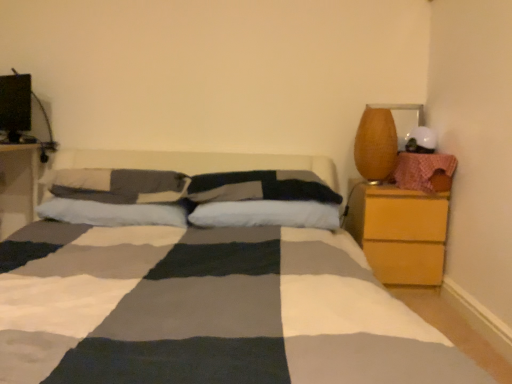
Question: Is white soft pillow at center, placed as the fourth pillow when sorted from left to right, smaller than matte brown vase at right?

Choices:
 (A) no
 (B) yes

Answer: (A)

Question: Is matte brown vase at right a part of white soft pillow at center, placed as the fourth pillow when sorted from left to right?

Choices:
 (A) yes
 (B) no

Answer: (B)

Question: Does white soft pillow at center, which is the 1th pillow in right-to-left order, have a lesser height compared to matte brown vase at right?

Choices:
 (A) yes
 (B) no

Answer: (A)

Question: Can you confirm if white soft pillow at center, placed as the fourth pillow when sorted from left to right, is taller than matte brown vase at right?

Choices:
 (A) yes
 (B) no

Answer: (B)

Question: From a real-world perspective, is white soft pillow at center, placed as the fourth pillow when sorted from left to right, positioned under matte brown vase at right based on gravity?

Choices:
 (A) no
 (B) yes

Answer: (B)

Question: Is white soft pillow at center, which is the 1th pillow in right-to-left order, bigger than matte brown vase at right?

Choices:
 (A) no
 (B) yes

Answer: (B)

Question: Is white cotton pillow at center, positioned as the fourth pillow in right-to-left order, surrounding white soft pillow at center, acting as the second pillow starting from the left?

Choices:
 (A) no
 (B) yes

Answer: (A)

Question: Is white cotton pillow at center, the 1th pillow when ordered from left to right, not inside white soft pillow at center, the 3th pillow positioned from the right?

Choices:
 (A) yes
 (B) no

Answer: (A)

Question: Considering the relative sizes of white cotton pillow at center, the 1th pillow when ordered from left to right, and white soft pillow at center, the 3th pillow positioned from the right, in the image provided, is white cotton pillow at center, the 1th pillow when ordered from left to right, thinner than white soft pillow at center, the 3th pillow positioned from the right,?

Choices:
 (A) no
 (B) yes

Answer: (A)

Question: Does white cotton pillow at center, positioned as the fourth pillow in right-to-left order, lie behind white soft pillow at center, the 3th pillow positioned from the right?

Choices:
 (A) no
 (B) yes

Answer: (B)

Question: Is white cotton pillow at center, the 1th pillow when ordered from left to right, closer to camera compared to white soft pillow at center, acting as the second pillow starting from the left?

Choices:
 (A) yes
 (B) no

Answer: (B)

Question: Is white cotton pillow at center, the 1th pillow when ordered from left to right, not near white soft pillow at center, acting as the second pillow starting from the left?

Choices:
 (A) no
 (B) yes

Answer: (A)

Question: Is matte brown vase at right not within white cotton pillow at center, positioned as the fourth pillow in right-to-left order?

Choices:
 (A) yes
 (B) no

Answer: (A)